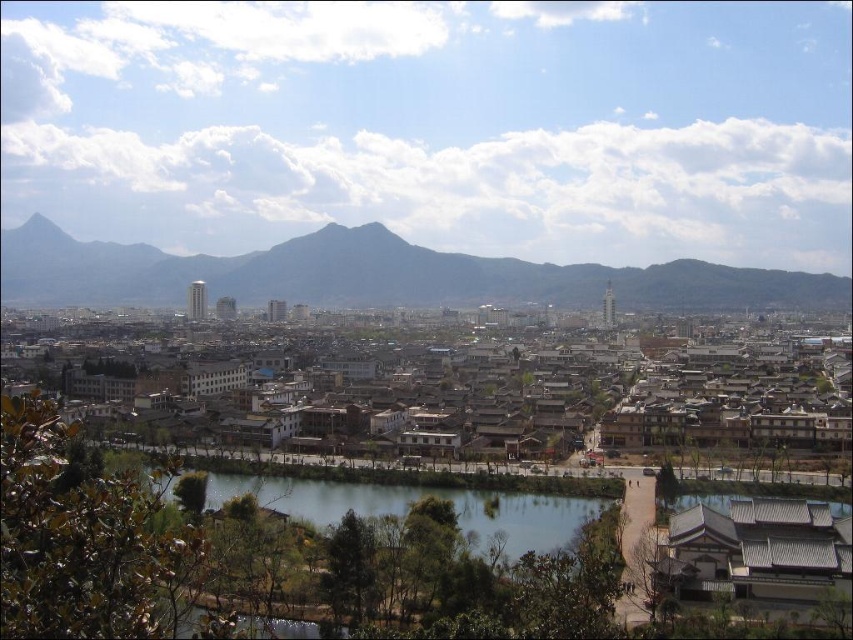
You are an architect planning to build a new observation deck that needs to have an unobstructed view of both the matte gray mountain at center and the green smooth water at center. Based on the scene, is there any object blocking the view between these two landmarks?

The matte gray mountain at center is positioned over the green smooth water at center, which means the mountain is in front of the water from the observer perspective. This would block the view of the water if looking from the mountain side, but since the mountain is at the center and over the water, the observation deck would need to be placed in a position where both can be seen without obstruction, possibly to the side where the mountain doesn not block the water view.

You are an urban planner analyzing the city layout. The city wants to build a new park that covers the same area as the green smooth water at center. Based on the scene, can the matte gray mountain at center be used to accommodate this park? Explain your reasoning.

The matte gray mountain at center is larger in size than the green smooth water at center. Therefore, the mountain has sufficient space to accommodate a park of the same size as the water area.

You are a city planner analyzing the cityscape. You need to determine which area is wider between the matte gray mountain at center and the green smooth water at center. Based on the scene, which one is wider?

The matte gray mountain at center is wider than the green smooth water at center according to the description.